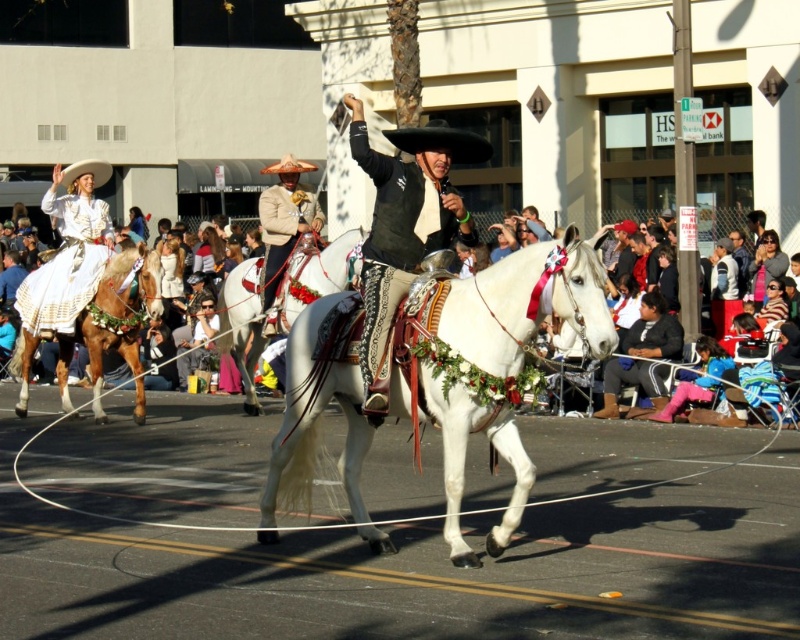
Question: Can you confirm if pink fabric pants at lower right is positioned above brown felt cowboy hat at center?

Choices:
 (A) yes
 (B) no

Answer: (B)

Question: Is beige fabric hat at center further to camera compared to pink fabric pants at lower right?

Choices:
 (A) yes
 (B) no

Answer: (A)

Question: Is white glossy horse at center to the right of shiny black leather jacket at center from the viewer's perspective?

Choices:
 (A) no
 (B) yes

Answer: (B)

Question: Which point appears farthest from the camera in this image?

Choices:
 (A) (476, 160)
 (B) (78, 176)

Answer: (B)

Question: Which of these objects is positioned closest to the white felt cowboy hat at upper left?

Choices:
 (A) shiny black leather jacket at center
 (B) white fabric crowd at center

Answer: (B)

Question: Based on their relative distances, which object is nearer to the brown glossy horse at left?

Choices:
 (A) white felt cowboy hat at upper left
 (B) beige fabric hat at center

Answer: (B)